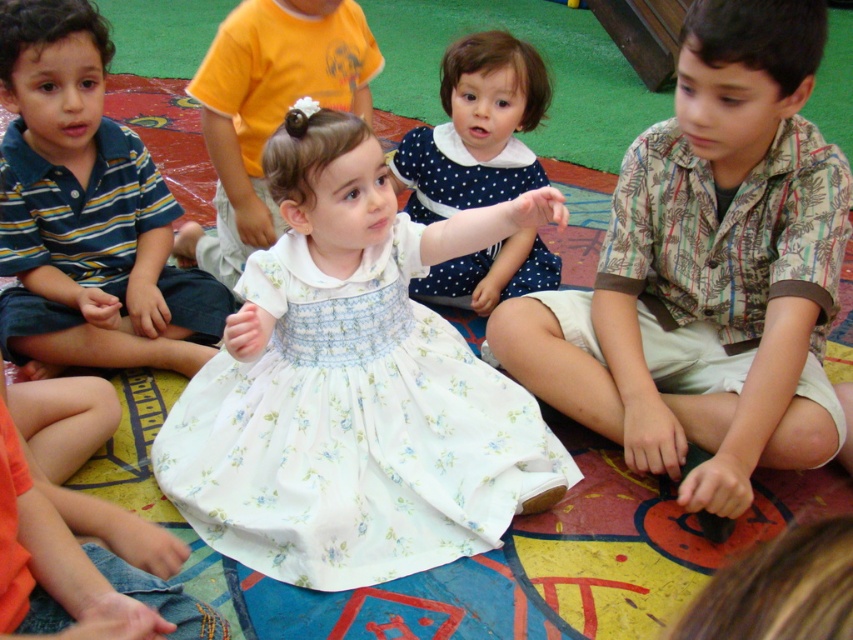
You are a photographer taking a picture of the children sitting on the colorful mat. You notice the matte yellow shirt at center and the white floral fabric dress at center. Which object should you adjust to ensure both are fully visible in the frame?

The matte yellow shirt at center is much taller than the white floral fabric dress at center, so you should lower the camera angle slightly to accommodate the height difference between the two objects.